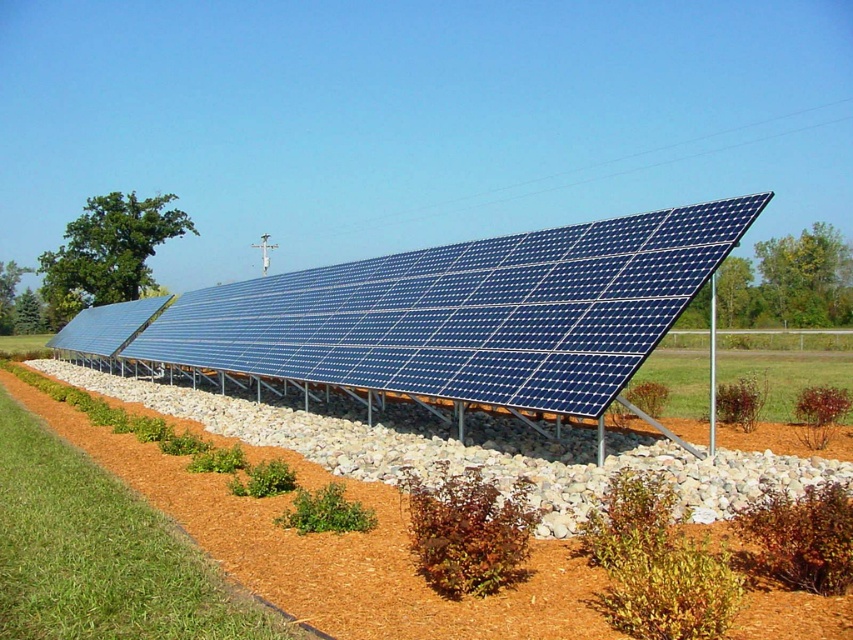
Does blue solar panel at center come behind brown mulch at lower center?

Yes, blue solar panel at center is behind brown mulch at lower center.

Who is shorter, blue solar panel at center or brown mulch at lower center?

Standing shorter between the two is brown mulch at lower center.

Which is behind, point (593, 278) or point (247, 506)?

The point (593, 278) is behind.

Find the location of a particular element. Image resolution: width=853 pixels, height=640 pixels. blue solar panel at center is located at coordinates (456, 314).